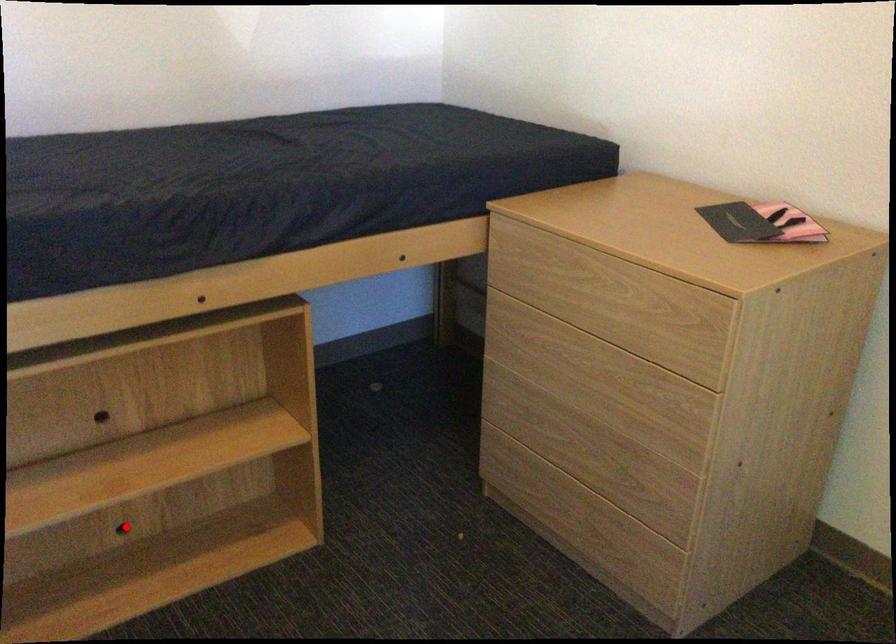
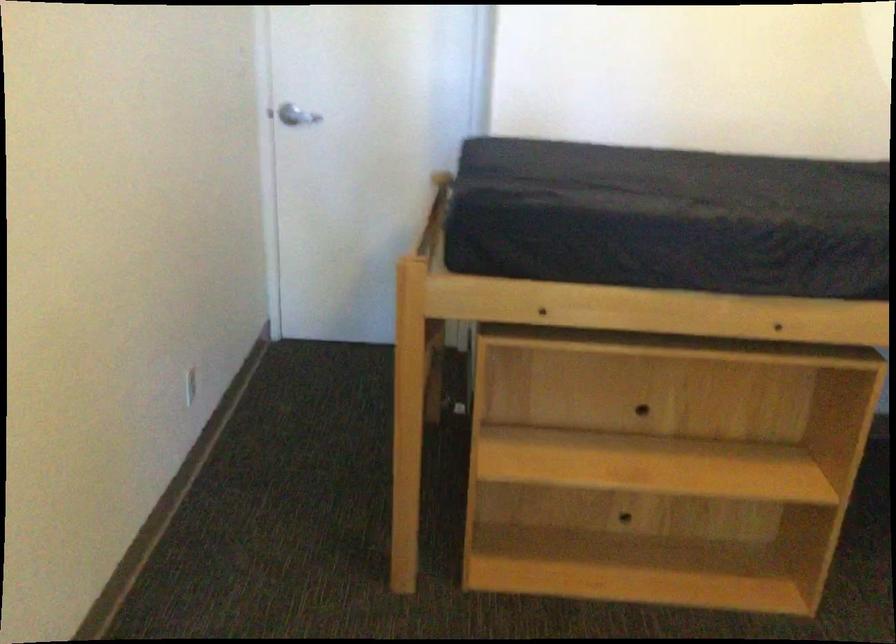
In the second image, find the point that corresponds to the highlighted location in the first image.

(623, 518)